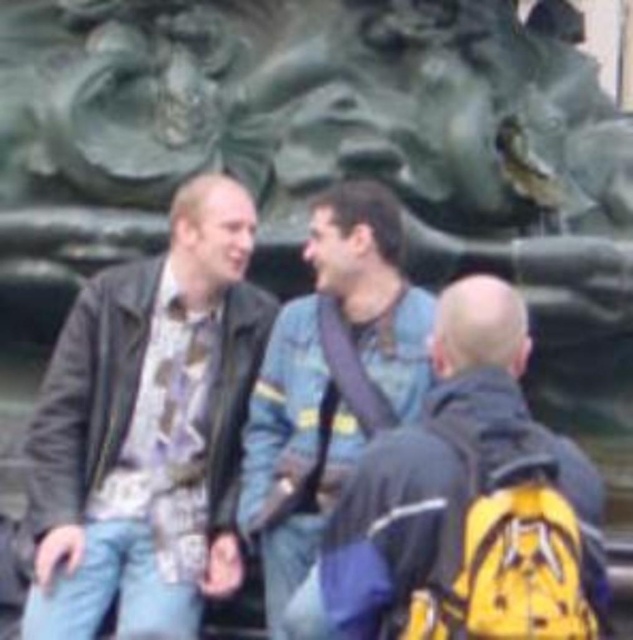
Who is taller, matte black jacket at center or yellow backpack at center?

matte black jacket at center is taller.

Is point (116, 499) closer to viewer compared to point (523, 532)?

No, it is not.

I want to click on matte black jacket at center, so click(147, 429).

Who is taller, matte black jacket at center or denim jacket at center?

matte black jacket at center

Looking at this image, who is more forward, (179,515) or (298,516)?

Point (298,516)

Who is more distant from viewer, [220,253] or [299,360]?

The point [220,253] is behind.

What are the coordinates of `matte black jacket at center` in the screenshot? It's located at (147, 429).

Which of these two, yellow backpack at center or denim jacket at center, stands shorter?

Standing shorter between the two is yellow backpack at center.

Does yellow backpack at center appear over denim jacket at center?

Actually, yellow backpack at center is below denim jacket at center.

Who is more forward, (492, 276) or (273, 609)?

Point (273, 609) is more forward.

At what (x,y) coordinates should I click in order to perform the action: click on yellow backpack at center. Please return your answer as a coordinate pair (x, y). Looking at the image, I should click on (465, 506).